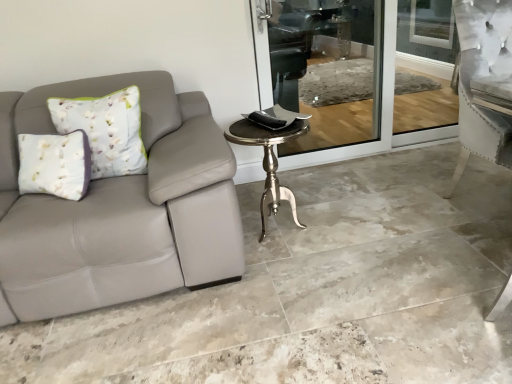
What do you see at coordinates (318, 291) in the screenshot?
I see `gray tile floor at lower left` at bounding box center [318, 291].

Find the location of `gray tile floor at lower left`. gray tile floor at lower left is located at coordinates (318, 291).

At what (x,y) coordinates should I click in order to perform the action: click on polished brass table at center. Please return your answer as a coordinate pair (x, y). This screenshot has height=384, width=512. Looking at the image, I should click on 268,162.

The image size is (512, 384). Describe the element at coordinates (268, 162) in the screenshot. I see `polished brass table at center` at that location.

I want to click on gray tile floor at lower left, so click(318, 291).

Which is more to the right, gray tile floor at lower left or polished brass table at center?

From the viewer's perspective, gray tile floor at lower left appears more on the right side.

Considering their positions, is gray tile floor at lower left located in front of or behind polished brass table at center?

Clearly, gray tile floor at lower left is in front of polished brass table at center.

Which is closer, (x=106, y=355) or (x=259, y=128)?

Point (x=106, y=355) is positioned closer to the camera compared to point (x=259, y=128).

From the image's perspective, which is above, gray tile floor at lower left or polished brass table at center?

gray tile floor at lower left is shown above in the image.

From a real-world perspective, is gray tile floor at lower left positioned under polished brass table at center based on gravity?

Indeed, from a real-world perspective, gray tile floor at lower left is positioned beneath polished brass table at center.

Which of these two, gray tile floor at lower left or polished brass table at center, is thinner?

Thinner between the two is polished brass table at center.

Considering the relative sizes of gray tile floor at lower left and polished brass table at center in the image provided, is gray tile floor at lower left taller than polished brass table at center?

In fact, gray tile floor at lower left may be shorter than polished brass table at center.

Considering the sizes of objects gray tile floor at lower left and polished brass table at center in the image provided, who is bigger, gray tile floor at lower left or polished brass table at center?

With larger size is gray tile floor at lower left.

Is gray tile floor at lower left positioned beyond the bounds of polished brass table at center?

Absolutely, gray tile floor at lower left is external to polished brass table at center.

Looking at this image, is gray tile floor at lower left far away from polished brass table at center?

No.

Is polished brass table at center at the back of gray tile floor at lower left?

gray tile floor at lower left does not have its back to polished brass table at center.

What's the angular difference between gray tile floor at lower left and polished brass table at center's facing directions?

0.0553 degrees.

Locate an element on the screen. Image resolution: width=512 pixels, height=384 pixels. concrete lying above the polished brass table at center (from the image's perspective) is located at coordinates (318, 291).

Which object is positioned more to the right, polished brass table at center or gray tile floor at lower left?

gray tile floor at lower left is more to the right.

Looking at this image, which is behind, polished brass table at center or gray tile floor at lower left?

Positioned behind is polished brass table at center.

Which is in front, point (294, 131) or point (182, 378)?

The point (182, 378) is more forward.

From the image's perspective, would you say polished brass table at center is positioned over gray tile floor at lower left?

No, from the image's perspective, polished brass table at center is not above gray tile floor at lower left.

From a real-world perspective, is polished brass table at center above or below gray tile floor at lower left?

In terms of real-world spatial position, polished brass table at center is above gray tile floor at lower left.

Does polished brass table at center have a greater width compared to gray tile floor at lower left?

No, polished brass table at center is not wider than gray tile floor at lower left.

Based on the photo, between polished brass table at center and gray tile floor at lower left, which one has more height?

polished brass table at center is taller.

Based on the photo, considering the relative sizes of polished brass table at center and gray tile floor at lower left in the image provided, is polished brass table at center smaller than gray tile floor at lower left?

Yes, polished brass table at center is smaller than gray tile floor at lower left.

Is polished brass table at center situated inside gray tile floor at lower left or outside?

polished brass table at center is located beyond the bounds of gray tile floor at lower left.

Is polished brass table at center placed right next to gray tile floor at lower left?

No, polished brass table at center is not making contact with gray tile floor at lower left.

Is polished brass table at center facing towards gray tile floor at lower left?

No, polished brass table at center is not facing towards gray tile floor at lower left.

Can you tell me how much polished brass table at center and gray tile floor at lower left differ in facing direction?

polished brass table at center and gray tile floor at lower left are facing 0.0553 degrees away from each other.

How much distance is there between polished brass table at center and gray tile floor at lower left?

polished brass table at center and gray tile floor at lower left are 23.34 inches apart from each other.

I want to click on concrete in front of the polished brass table at center, so click(318, 291).

Identify the location of concrete located above the polished brass table at center (from the image's perspective). The height and width of the screenshot is (384, 512). (318, 291).

What are the coordinates of `concrete in front of the polished brass table at center` in the screenshot? It's located at (318, 291).